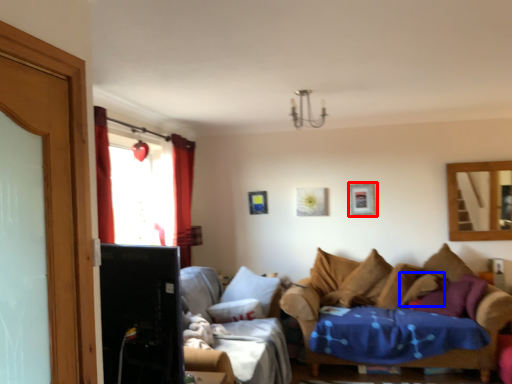
Question: Which of the following is the farthest to the observer, picture frame (highlighted by a red box) or pillow (highlighted by a blue box)?

Choices:
 (A) picture frame
 (B) pillow

Answer: (A)